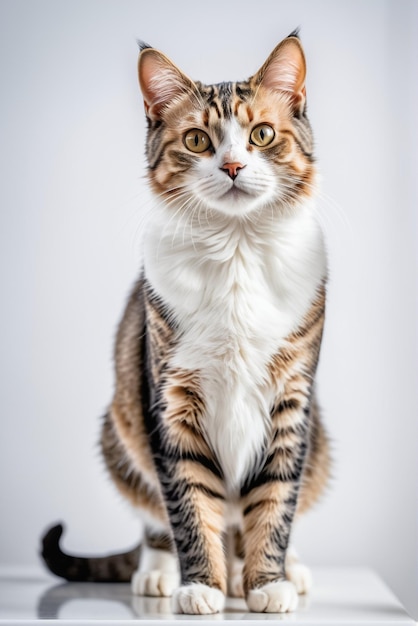
Where is `table top`? Image resolution: width=418 pixels, height=626 pixels. table top is located at coordinates (91, 598).